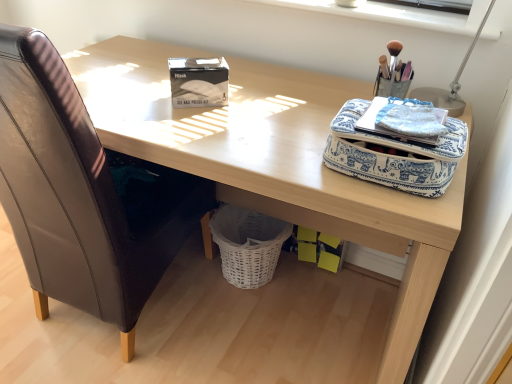
Locate an element on the screen. The width and height of the screenshot is (512, 384). free space in front of white matte gel nail polish kit at upper center is located at coordinates (195, 125).